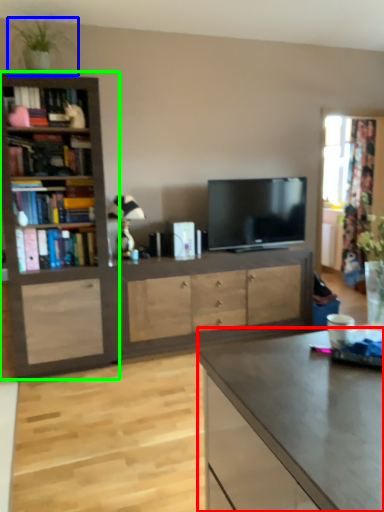
Question: Based on their relative distances, which object is nearer to desk (highlighted by a red box)? Choose from houseplant (highlighted by a blue box) and bookcase (highlighted by a green box).

Choices:
 (A) houseplant
 (B) bookcase

Answer: (B)